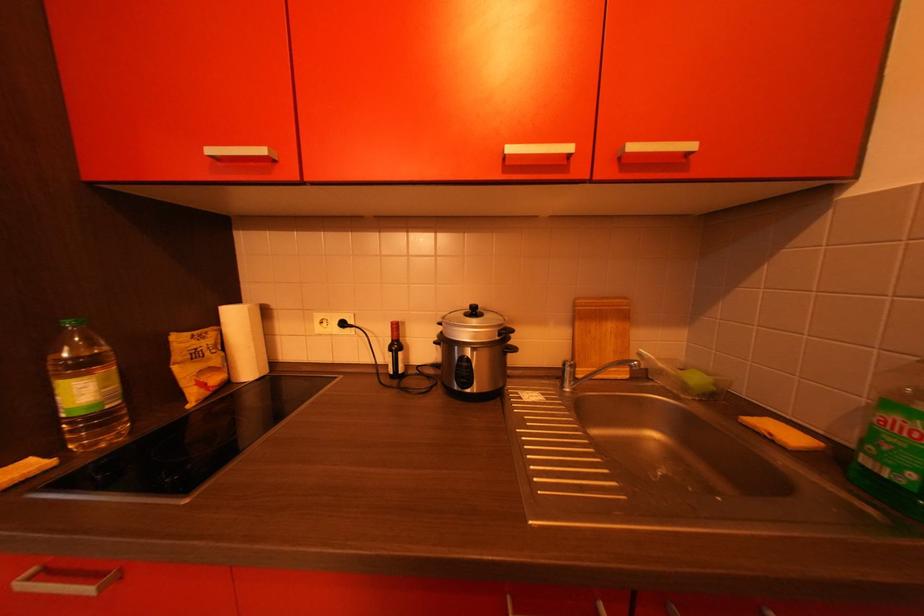
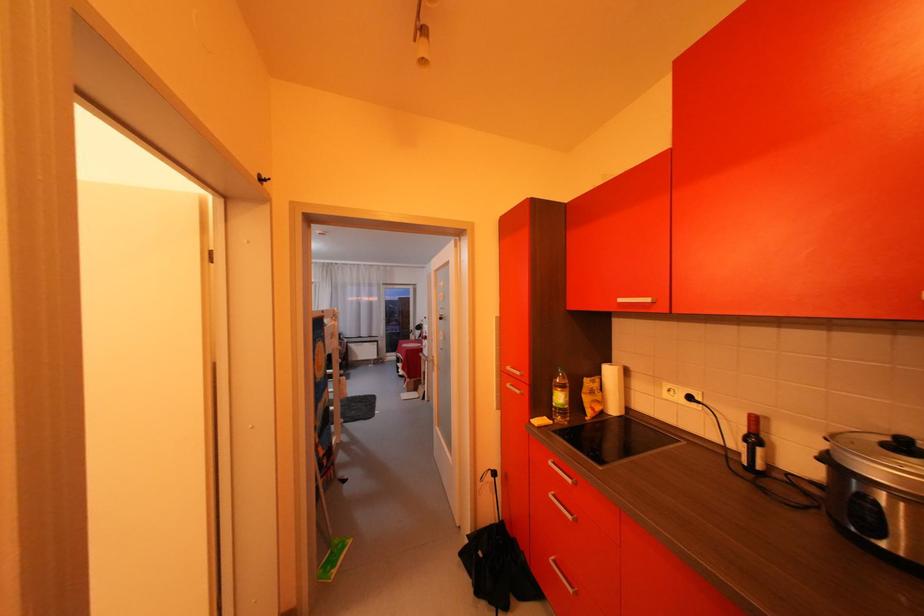
Find the pixel in the second image that matches point (400, 342) in the first image.

(757, 434)